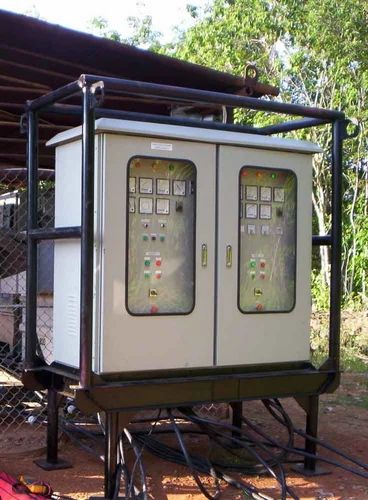
Where is `red lights`? Image resolution: width=368 pixels, height=500 pixels. red lights is located at coordinates (159, 259), (160, 275), (155, 307), (259, 307), (264, 263), (263, 276), (247, 172), (262, 173), (155, 164), (138, 164).